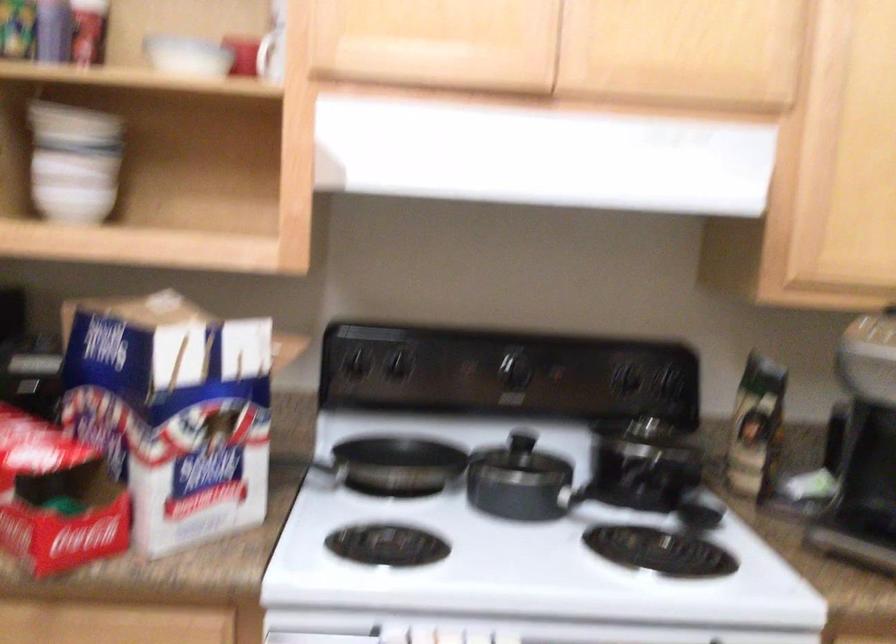
Image resolution: width=896 pixels, height=644 pixels. Describe the element at coordinates (265, 55) in the screenshot. I see `the white mug handle` at that location.